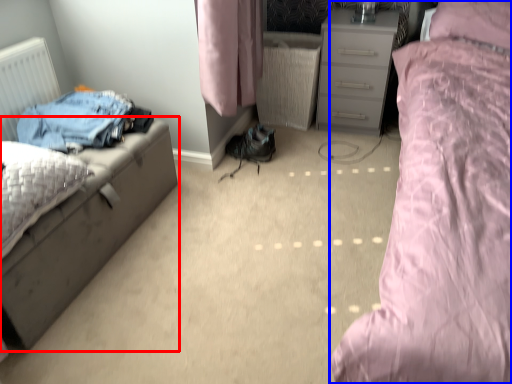
Question: Among these objects, which one is nearest to the camera, nightstand (highlighted by a red box) or bed (highlighted by a blue box)?

Choices:
 (A) nightstand
 (B) bed

Answer: (B)